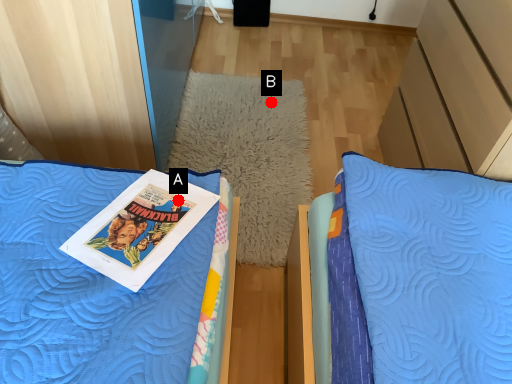
Question: Two points are circled on the image, labeled by A and B beside each circle. Which point is further to the camera?

Choices:
 (A) A is further
 (B) B is further

Answer: (B)